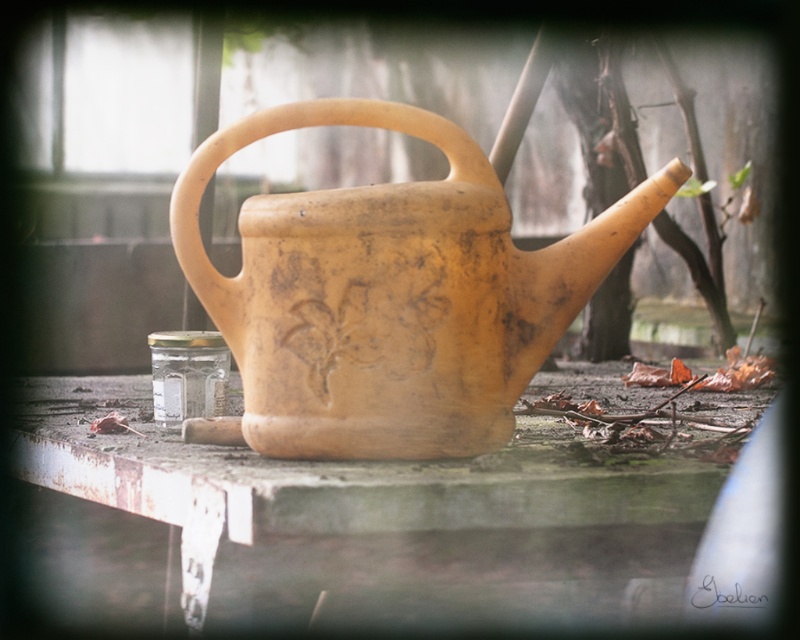
You are a gardener who needs to place a 25 cm long tool on the surface between the rusty metal table at center and the matte yellow clay watering can at center. Can you fit it there?

The distance between the rusty metal table at center and the matte yellow clay watering can at center is 24.90 centimeters, so the 25 cm long tool cannot fit as it is slightly longer than the available space.

You are arranging items on a table and need to place a new object between the rusty metal table at center and the matte yellow clay watering can at center. Based on their positions, where should you place the new object?

The rusty metal table at center is below the matte yellow clay watering can at center, so the new object should be placed between them either on the table surface or suspended in the space between the table and the watering can.